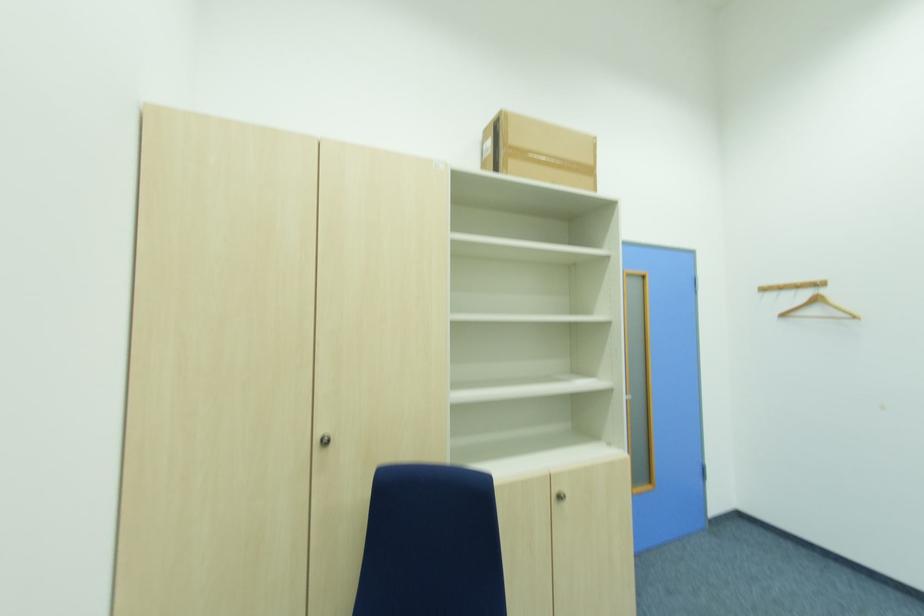
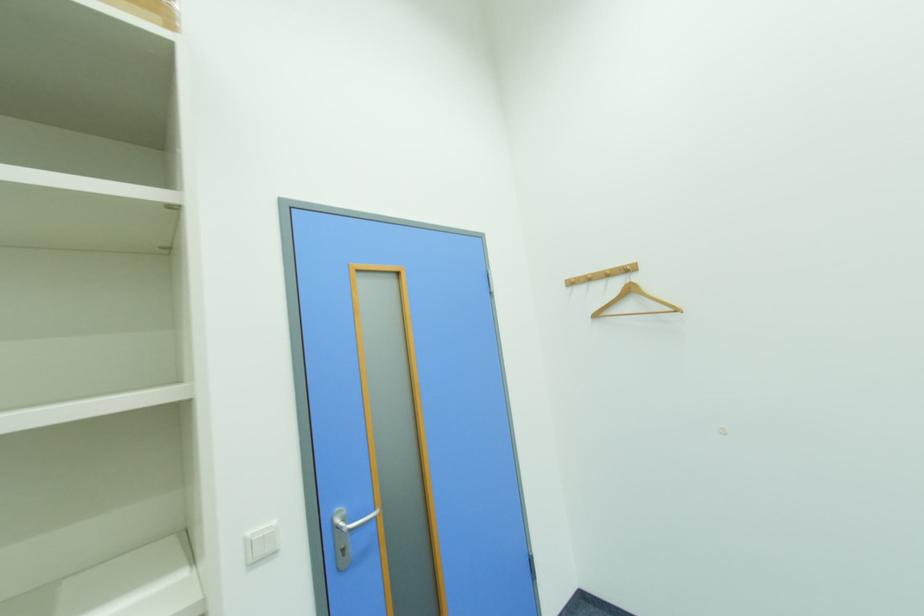
Where in the second image is the point corresponding to (x=824, y=284) from the first image?

(634, 267)